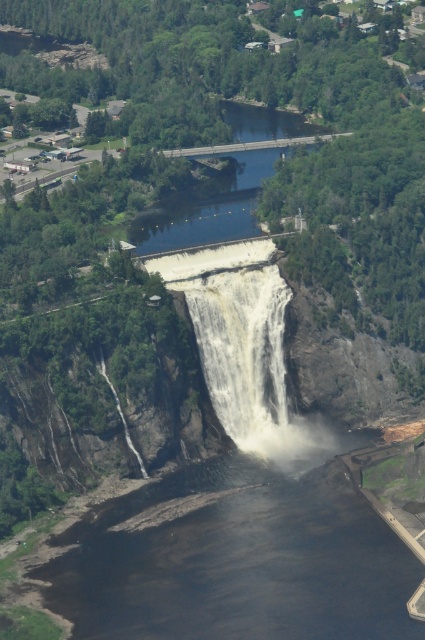
Question: Is white frothy water at center smaller than clear water at center?

Choices:
 (A) no
 (B) yes

Answer: (B)

Question: Which point appears closest to the camera in this image?

Choices:
 (A) (254, 502)
 (B) (286, 134)

Answer: (A)

Question: Is dark water at lower left above clear water at center?

Choices:
 (A) no
 (B) yes

Answer: (A)

Question: Does white frothy water at center have a greater width compared to clear water at center?

Choices:
 (A) yes
 (B) no

Answer: (B)

Question: Which point is closer to the camera taking this photo?

Choices:
 (A) (238, 160)
 (B) (108, 573)
 (C) (275, 305)

Answer: (B)

Question: Estimate the real-world distances between objects in this image. Which object is closer to the dark water at lower left?

Choices:
 (A) clear water at center
 (B) white frothy water at center

Answer: (B)